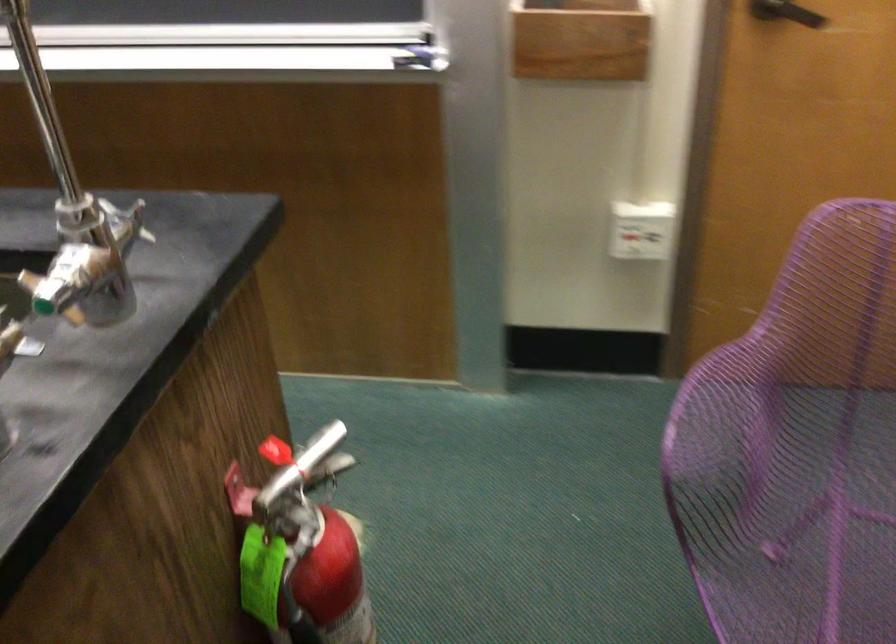
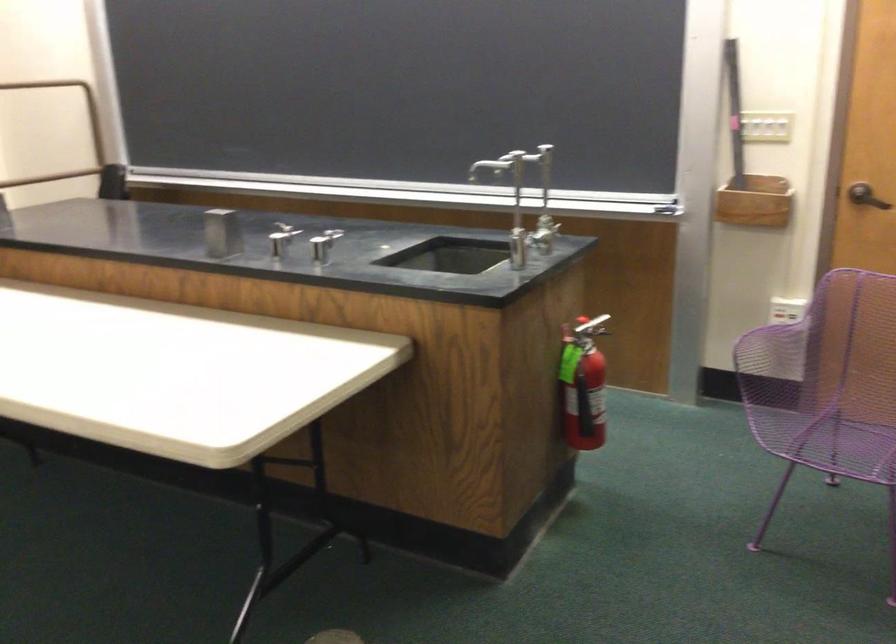
Question: I am providing you with two images of the same scene from different viewpoints. Please identify which objects are invisible in image2.

Choices:
 (A) fire extinguisher handle
 (B) silver faucet lever
 (C) light switch
 (D) none of these

Answer: (D)